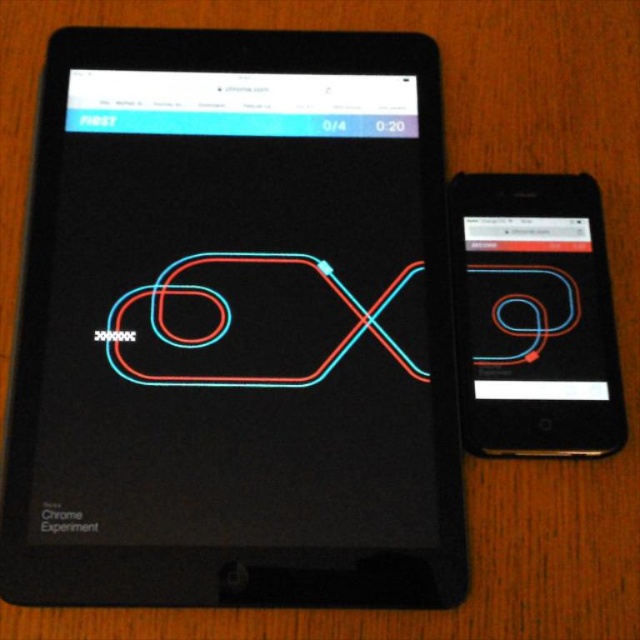
You have a protective case that fits devices up to 15 cm in width. You need to determine which device between the black glossy tablet at upper left and the matte black phone at right can fit into the case. Which one should you choose?

The black glossy tablet at upper left has a larger width than the matte black phone at right. Since the case can only accommodate devices up to 15 cm, you should choose the matte black phone at right to ensure it fits properly.

You are organizing a display for an art exhibition and need to ensure that the black glossy tablet at upper left and the matte black phone at right are positioned correctly. According to the spatial arrangement, which device should be placed higher to maintain the correct orientation?

The black glossy tablet at upper left should be placed higher than the matte black phone at right to maintain the correct orientation, as it is positioned above the phone in the image.

You have a small toy car that is 8 inches long. You want to place it between the black glossy tablet at upper left and the matte black phone at right. Will the toy car fit entirely between them without overlapping either device?

The distance between the black glossy tablet at upper left and the matte black phone at right is 7.70 inches. Since the toy car is 8 inches long, it will not fit entirely between them without overlapping either device.